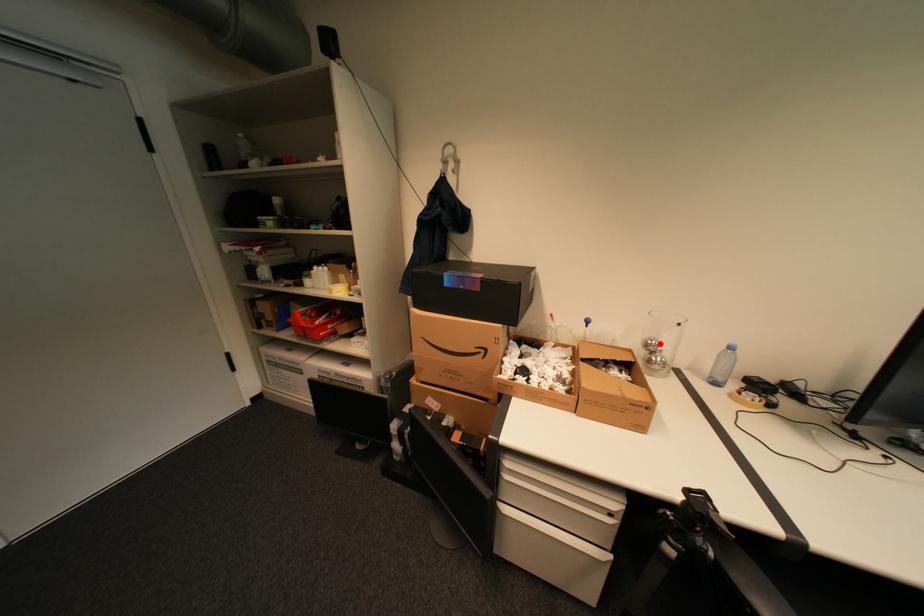
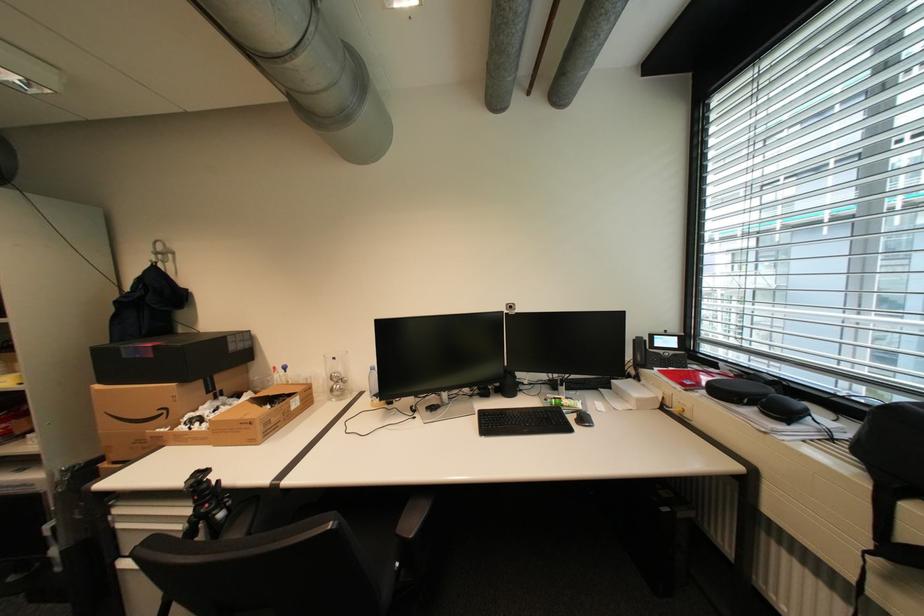
Question: I am providing you with two images of the same scene from different viewpoints. In image1, a red point is highlighted. Considering the same 3D point in image2, which of the following is correct?

Choices:
 (A) It is closer
 (B) It is farther

Answer: (B)